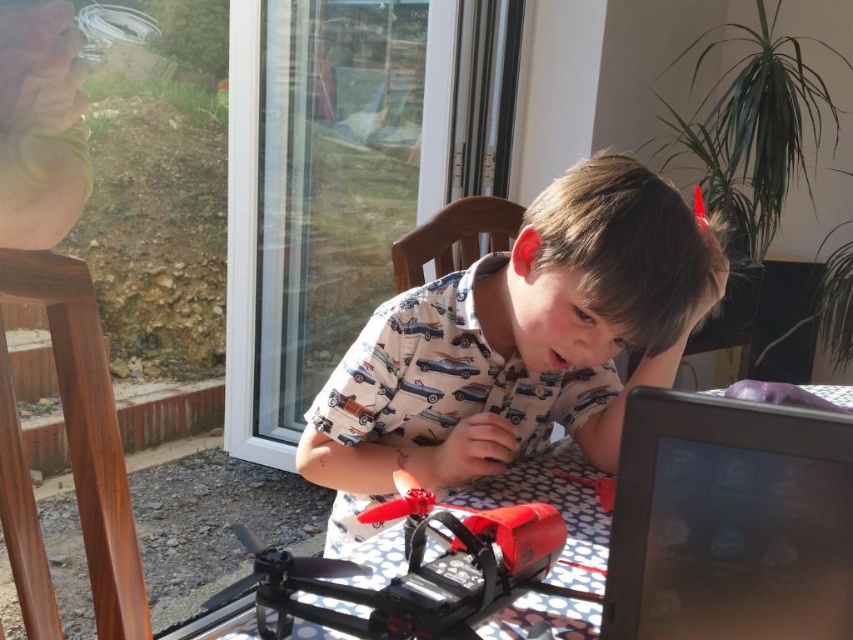
Looking at this image, which is below, white cotton shirt at center or black glossy tablet at lower right?

black glossy tablet at lower right is lower down.

From the picture: Who is shorter, white cotton shirt at center or black glossy tablet at lower right?

With less height is black glossy tablet at lower right.

Who is more distant from viewer, (450,310) or (836,486)?

Positioned behind is point (450,310).

This screenshot has width=853, height=640. Find the location of `white cotton shirt at center`. white cotton shirt at center is located at coordinates (515, 342).

Can you confirm if transparent glass screen door at upper center is wider than matte black drone at center?

Yes, transparent glass screen door at upper center is wider than matte black drone at center.

Is transparent glass screen door at upper center smaller than matte black drone at center?

Incorrect, transparent glass screen door at upper center is not smaller in size than matte black drone at center.

Locate an element on the screen. transparent glass screen door at upper center is located at coordinates (323, 188).

Does transparent glass screen door at upper center have a greater height compared to shiny red drone at center?

Correct, transparent glass screen door at upper center is much taller as shiny red drone at center.

Looking at this image, can you confirm if transparent glass screen door at upper center is positioned to the right of shiny red drone at center?

In fact, transparent glass screen door at upper center is to the left of shiny red drone at center.

Which is in front, point (231, 182) or point (376, 604)?

Point (376, 604) is more forward.

Locate an element on the screen. Image resolution: width=853 pixels, height=640 pixels. transparent glass screen door at upper center is located at coordinates (323, 188).